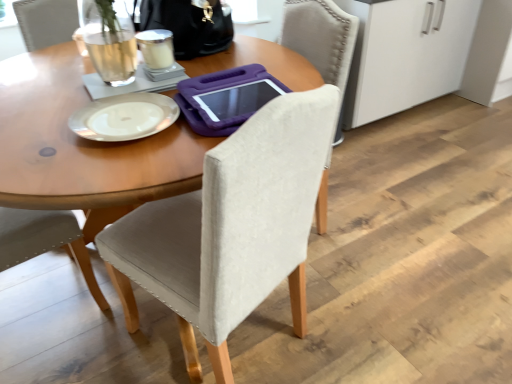
At what (x,y) coordinates should I click in order to perform the action: click on free space to the left of white frosted glass at upper center. Please return your answer as a coordinate pair (x, y). Looking at the image, I should click on 114,83.